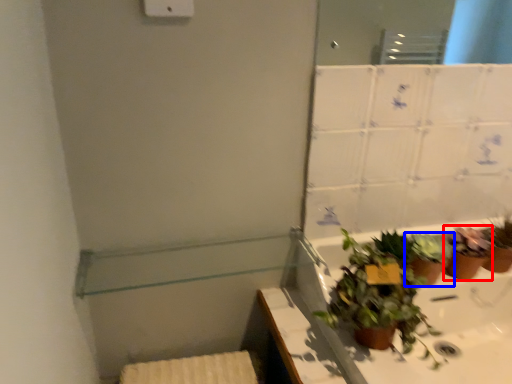
Question: Which of the following is the farthest to the observer, houseplant (highlighted by a red box) or houseplant (highlighted by a blue box)?

Choices:
 (A) houseplant
 (B) houseplant

Answer: (A)